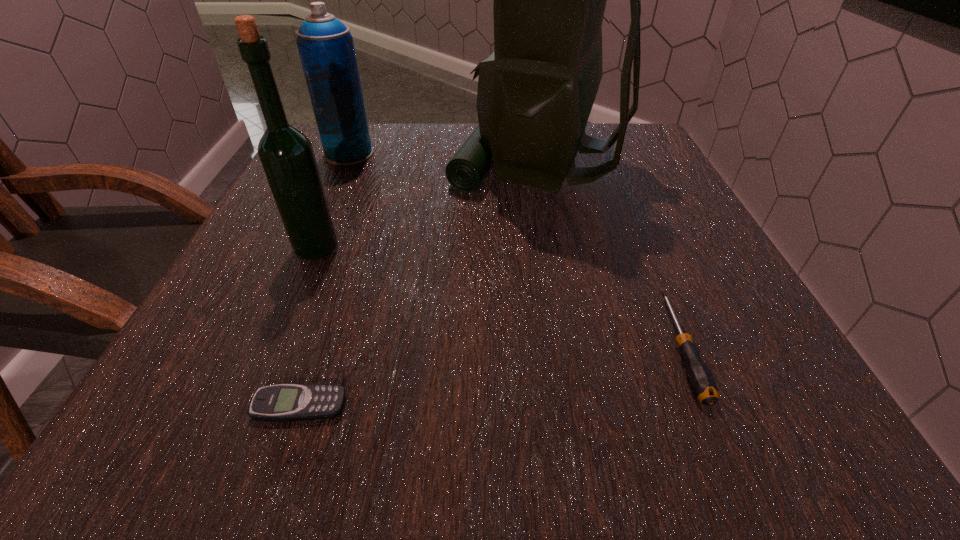
What are the coordinates of `backpack located in the right edge section of the desktop` in the screenshot? It's located at (535, 93).

You are a GUI agent. You are given a task and a screenshot of the screen. Output one action in this format:
    pyautogui.click(x=<x>, y=<y>)
    Task: Click on the screwdriver situated at the right edge
    The height and width of the screenshot is (540, 960).
    Given the screenshot: What is the action you would take?
    pyautogui.click(x=701, y=380)

The width and height of the screenshot is (960, 540). I want to click on object located in the far left corner section of the desktop, so click(325, 45).

This screenshot has width=960, height=540. I want to click on object that is at the near left corner, so click(283, 402).

At what (x,y) coordinates should I click in order to perform the action: click on object that is at the far right corner. Please return your answer as a coordinate pair (x, y). This screenshot has height=540, width=960. Looking at the image, I should click on (535, 93).

At what (x,y) coordinates should I click in order to perform the action: click on object that is at the near right corner. Please return your answer as a coordinate pair (x, y). Looking at the image, I should click on (701, 380).

The height and width of the screenshot is (540, 960). Find the location of `vacant space at the far edge of the desktop`. vacant space at the far edge of the desktop is located at coordinates (446, 147).

This screenshot has width=960, height=540. Identify the location of free region at the near edge. (436, 424).

You are a GUI agent. You are given a task and a screenshot of the screen. Output one action in this format:
    pyautogui.click(x=<x>, y=<y>)
    Task: Click on the free location at the left edge of the desktop
    The height and width of the screenshot is (540, 960).
    Given the screenshot: What is the action you would take?
    pyautogui.click(x=358, y=191)

This screenshot has height=540, width=960. What are the coordinates of `vacant space at the right edge of the desktop` in the screenshot? It's located at (685, 314).